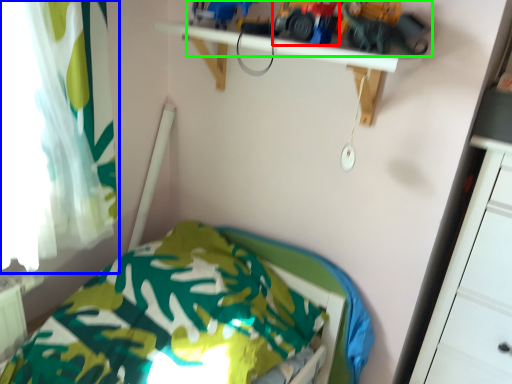
Question: Estimate the real-world distances between objects in this image. Which object is farther from toy car (highlighted by a red box), curtain (highlighted by a blue box) or toy (highlighted by a green box)?

Choices:
 (A) curtain
 (B) toy

Answer: (A)